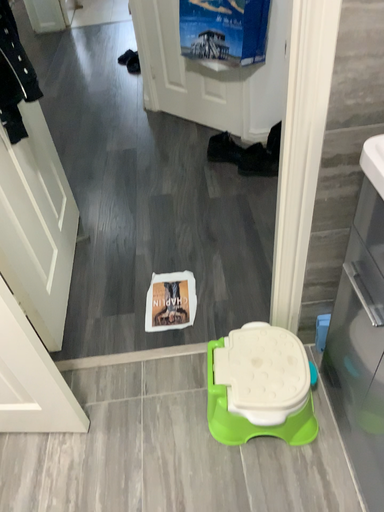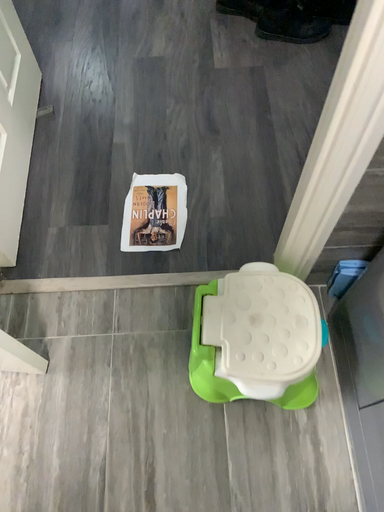
Question: Which way did the camera rotate in the video?

Choices:
 (A) rotated downward
 (B) rotated upward

Answer: (A)